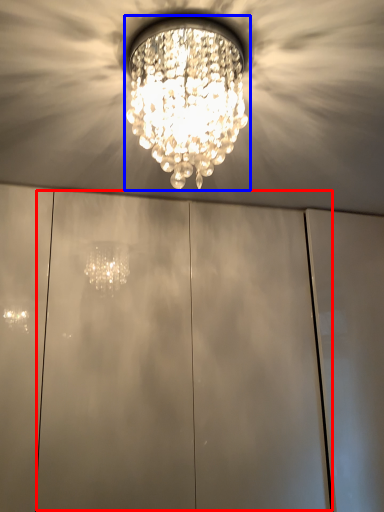
Question: Which object appears closest to the camera in this image, glass door (highlighted by a red box) or lamp (highlighted by a blue box)?

Choices:
 (A) glass door
 (B) lamp

Answer: (B)